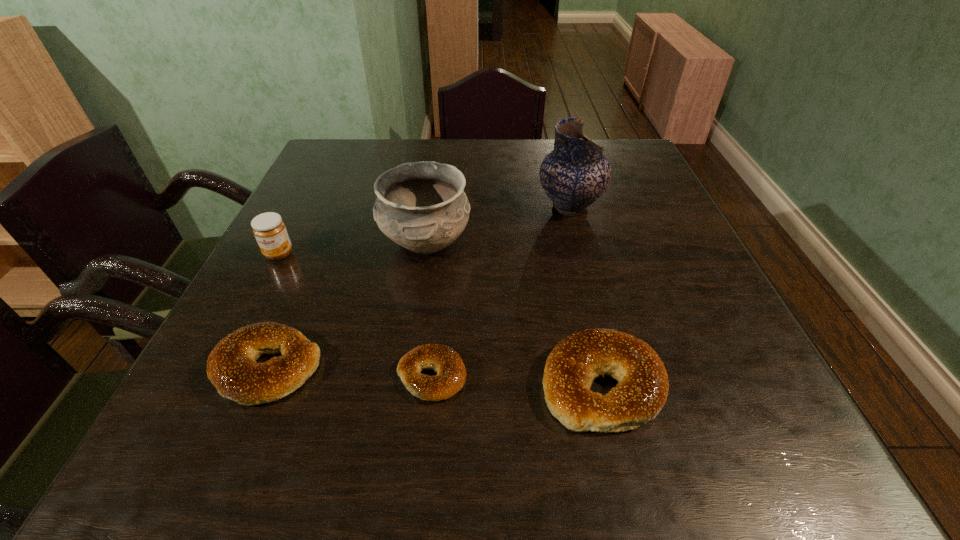
Locate an element on the screen. Image resolution: width=960 pixels, height=540 pixels. the leftmost bagel is located at coordinates (x=231, y=366).

At what (x,y) coordinates should I click in order to perform the action: click on the fifth tallest object. Please return your answer as a coordinate pair (x, y). The image size is (960, 540). Looking at the image, I should click on pos(231,366).

What are the coordinates of `the second bagel from left to right` in the screenshot? It's located at (451, 374).

Identify the location of the shortest object. (451, 374).

I want to click on the rightmost bagel, so click(x=576, y=361).

Where is `the taller pottery`? This screenshot has width=960, height=540. the taller pottery is located at coordinates (575, 174).

Identify the location of the tallest object. (575, 174).

Where is `jam`? This screenshot has height=540, width=960. jam is located at coordinates (269, 229).

Find the location of a particular element. This screenshot has height=540, width=960. the second tallest object is located at coordinates (421, 206).

I want to click on the left pottery, so click(x=421, y=206).